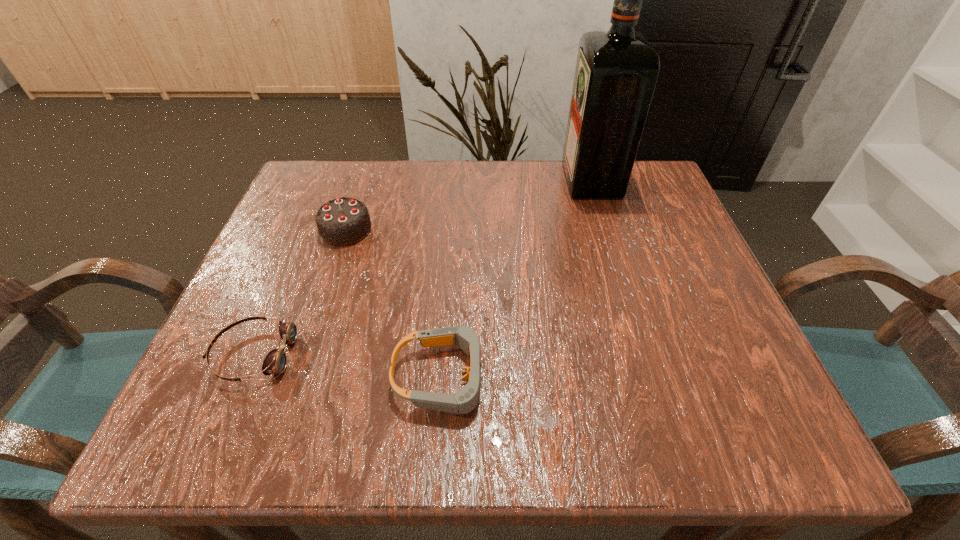
Where is `the farthest object`? This screenshot has height=540, width=960. the farthest object is located at coordinates (616, 72).

Locate an element on the screen. liquor is located at coordinates (616, 72).

The image size is (960, 540). I want to click on chocolate cake, so (343, 221).

At what (x,y) coordinates should I click in order to perform the action: click on the second farthest object. Please return your answer as a coordinate pair (x, y). Looking at the image, I should click on (x=343, y=221).

I want to click on the taller goggles, so click(x=466, y=399).

Locate an element on the screen. This screenshot has height=540, width=960. the right goggles is located at coordinates (466, 399).

In order to click on the left goggles in this screenshot , I will do `click(275, 362)`.

At what (x,y) coordinates should I click in order to perform the action: click on the shortest object. Please return your answer as a coordinate pair (x, y). The image size is (960, 540). Looking at the image, I should click on (275, 362).

Locate an element on the screen. The width and height of the screenshot is (960, 540). vacant space positioned 0.400m on the front label of the rightmost object is located at coordinates click(400, 180).

The width and height of the screenshot is (960, 540). I want to click on vacant point located on the front label of the rightmost object, so click(x=516, y=180).